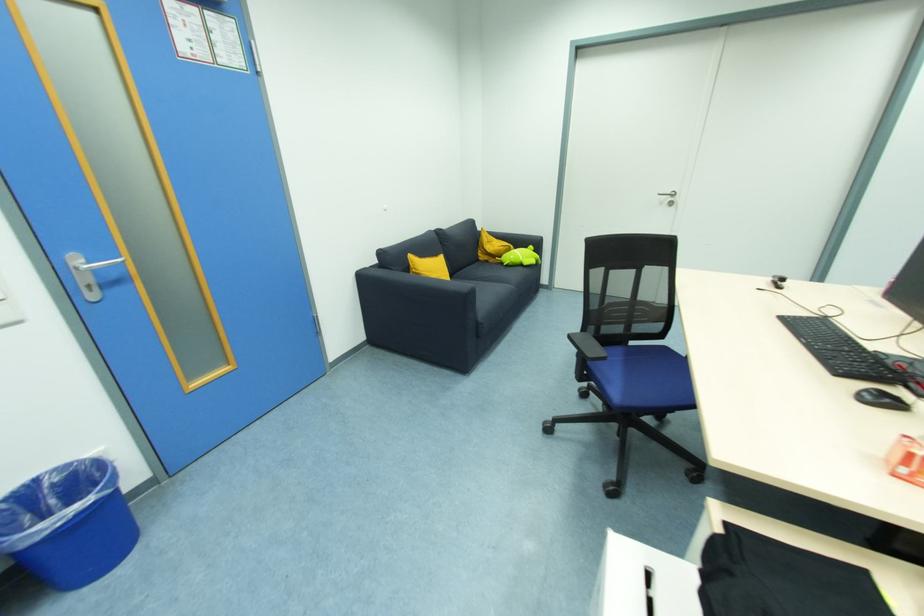
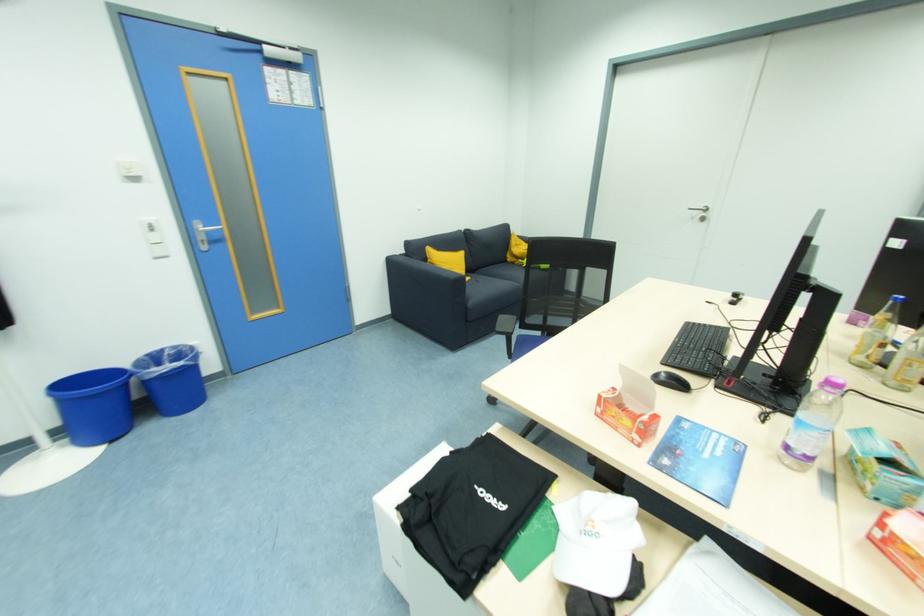
Find the pixel in the second image that matches [99,297] in the first image.

(208, 249)